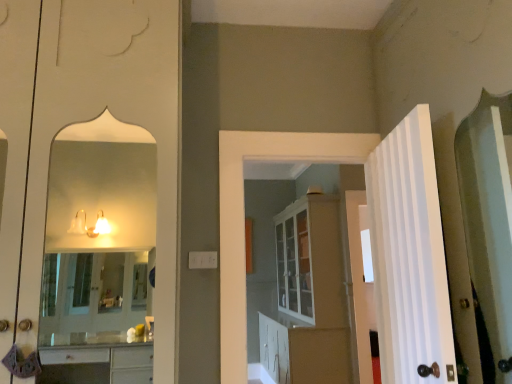
Question: In terms of height, does white striped door at right, which appears as the first door when viewed from the front, look taller or shorter compared to white glossy cabinet at center?

Choices:
 (A) tall
 (B) short

Answer: (B)

Question: From a real-world perspective, relative to white glossy cabinet at center, is white striped door at right, which appears as the first door when viewed from the front, vertically above or below?

Choices:
 (A) above
 (B) below

Answer: (A)

Question: Which is nearer to the white glossy door at right, which is counted as the 3th door, starting from the left?

Choices:
 (A) white glossy cabinet at center, positioned as the first door in left-to-right order
 (B) white glossy cabinet at center
 (C) white striped door at right, which appears as the 2th door when viewed from the right

Answer: (B)

Question: Based on their relative distances, which object is nearer to the white glossy cabinet at center?

Choices:
 (A) white glossy door at right, which is the 1th door in right-to-left order
 (B) white striped door at right, placed as the second door when sorted from left to right
 (C) white glossy cabinet at center, the third door positioned from the right

Answer: (A)